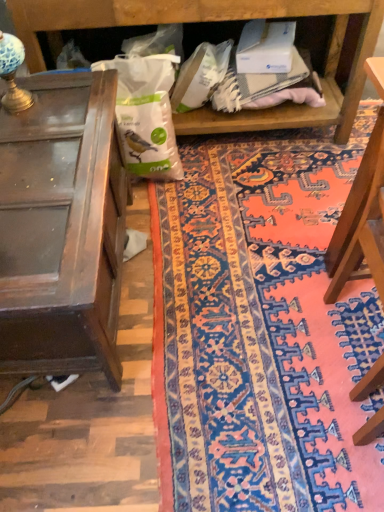
Describe the element at coordinates (62, 228) in the screenshot. I see `wooden table at left` at that location.

What is the approximate width of white matte paper bag at center?

The width of white matte paper bag at center is 11.47 inches.

This screenshot has height=512, width=384. Describe the element at coordinates (362, 209) in the screenshot. I see `wooden chair at right` at that location.

The image size is (384, 512). In order to click on blue glass lamp at upper left in this screenshot , I will do `click(13, 74)`.

How many degrees apart are the facing directions of blue glass lamp at upper left and wooden table at left?

The angle between the facing direction of blue glass lamp at upper left and the facing direction of wooden table at left is 1.25 degrees.

From a real-world perspective, is blue glass lamp at upper left over wooden table at left?

Yes.

From the image's perspective, would you say blue glass lamp at upper left is positioned over wooden table at left?

Yes, from the image's perspective, blue glass lamp at upper left is on top of wooden table at left.

Consider the image. Is wooden chair at right oriented away from patterned carpet at center?

No, patterned carpet at center is not at the back of wooden chair at right.

Is wooden chair at right to the left or to the right of patterned carpet at center in the image?

Based on their positions, wooden chair at right is located to the right of patterned carpet at center.

Locate an element on the screen. furniture below the patterned carpet at center (from the image's perspective) is located at coordinates (362, 209).

From the image's perspective, who appears lower, wooden chair at right or blue glass lamp at upper left?

wooden chair at right, from the image's perspective.

Which is more distant, (374, 375) or (2, 35)?

Point (2, 35)

Consider the image. Can you confirm if wooden chair at right is bigger than blue glass lamp at upper left?

Indeed, wooden chair at right has a larger size compared to blue glass lamp at upper left.

Image resolution: width=384 pixels, height=512 pixels. What are the coordinates of `paper bag above the patterned carpet at center (from the image's perspective)` in the screenshot? It's located at [146, 114].

Measure the distance between patterned carpet at center and white matte paper bag at center.

patterned carpet at center is 21.23 inches away from white matte paper bag at center.

Considering the positions of points (341, 393) and (132, 61), is point (341, 393) closer to camera compared to point (132, 61)?

That is True.

Which is behind, patterned carpet at center or white matte paper bag at center?

white matte paper bag at center is further from the camera.

Looking at this image, is white matte paper bag at center turned away from blue glass lamp at upper left?

No.

From the image's perspective, is white matte paper bag at center below blue glass lamp at upper left?

Yes.

From the picture: From a real-world perspective, which is physically below, white matte paper bag at center or blue glass lamp at upper left?

white matte paper bag at center.

The width and height of the screenshot is (384, 512). I want to click on paper bag below the blue glass lamp at upper left (from the image's perspective), so tap(146, 114).

From the image's perspective, which object appears higher, white matte paper bag at center or patterned carpet at center?

white matte paper bag at center appears higher in the image.

Which is less distant, (135, 128) or (202, 454)?

Point (135, 128).

From a real-world perspective, is white matte paper bag at center positioned above or below patterned carpet at center?

In terms of real-world spatial position, white matte paper bag at center is above patterned carpet at center.

Considering the relative positions of white matte paper bag at center and patterned carpet at center in the image provided, is white matte paper bag at center in front of patterned carpet at center?

That is False.

Is white matte paper bag at center shorter than wooden chair at right?

Yes, white matte paper bag at center is shorter than wooden chair at right.

Consider the image. Is white matte paper bag at center further to camera compared to wooden chair at right?

Yes, white matte paper bag at center is further from the viewer.

From a real-world perspective, is white matte paper bag at center on wooden chair at right?

No, from a real-world perspective, white matte paper bag at center is not over wooden chair at right

Is white matte paper bag at center situated inside wooden chair at right or outside?

white matte paper bag at center is located beyond the bounds of wooden chair at right.

The width and height of the screenshot is (384, 512). I want to click on lamp located above the wooden table at left (from the image's perspective), so click(13, 74).

I want to click on furniture that appears on the right of patterned carpet at center, so click(362, 209).

Considering their positions, is wooden table at left positioned further to blue glass lamp at upper left than white matte paper bag at center?

The object further to blue glass lamp at upper left is white matte paper bag at center.

Which object lies nearer to the anchor point blue glass lamp at upper left, patterned carpet at center or wooden table at left?

wooden table at left is closer to blue glass lamp at upper left.

Considering their positions, is white matte paper bag at center positioned further to blue glass lamp at upper left than patterned carpet at center?

patterned carpet at center is positioned further to the anchor blue glass lamp at upper left.

Considering their positions, is white matte paper bag at center positioned closer to wooden chair at right than patterned carpet at center?

patterned carpet at center is positioned closer to the anchor wooden chair at right.

Estimate the real-world distances between objects in this image. Which object is further from blue glass lamp at upper left, wooden table at left or wooden chair at right?

Based on the image, wooden chair at right appears to be further to blue glass lamp at upper left.

From the image, which object appears to be farther from wooden table at left, wooden chair at right or white matte paper bag at center?

wooden chair at right is further to wooden table at left.

Which object lies nearer to the anchor point white matte paper bag at center, wooden chair at right or wooden table at left?

wooden table at left.

When comparing their distances from wooden chair at right, does white matte paper bag at center or blue glass lamp at upper left seem closer?

white matte paper bag at center is positioned closer to the anchor wooden chair at right.

I want to click on paper bag between wooden table at left and wooden chair at right in the horizontal direction, so click(x=146, y=114).

The height and width of the screenshot is (512, 384). In order to click on mat between wooden chair at right and white matte paper bag at center from front to back in this screenshot , I will do `click(261, 329)`.

I want to click on paper bag located between blue glass lamp at upper left and patterned carpet at center in the left-right direction, so click(146, 114).

Locate an element on the screen. The width and height of the screenshot is (384, 512). mat between wooden table at left and wooden chair at right is located at coordinates (261, 329).